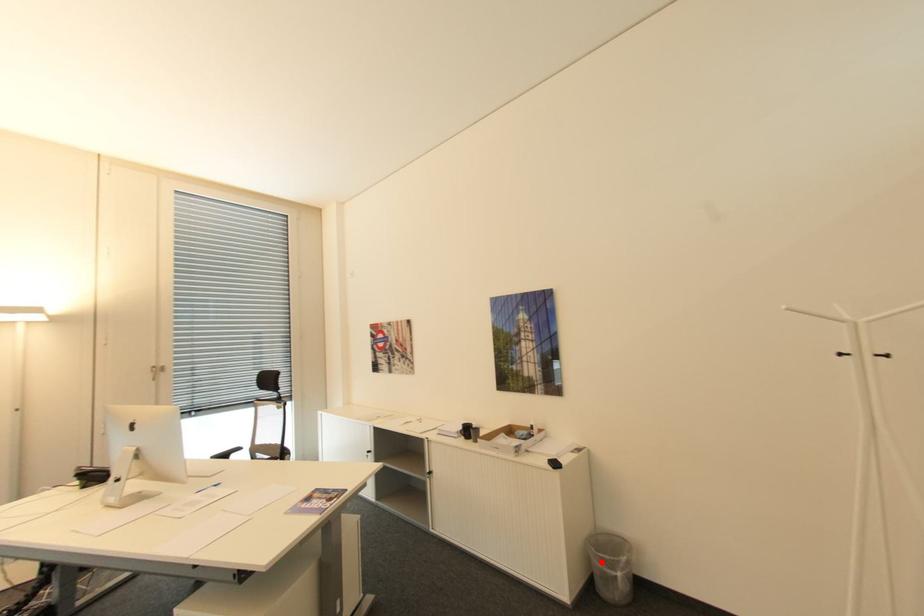
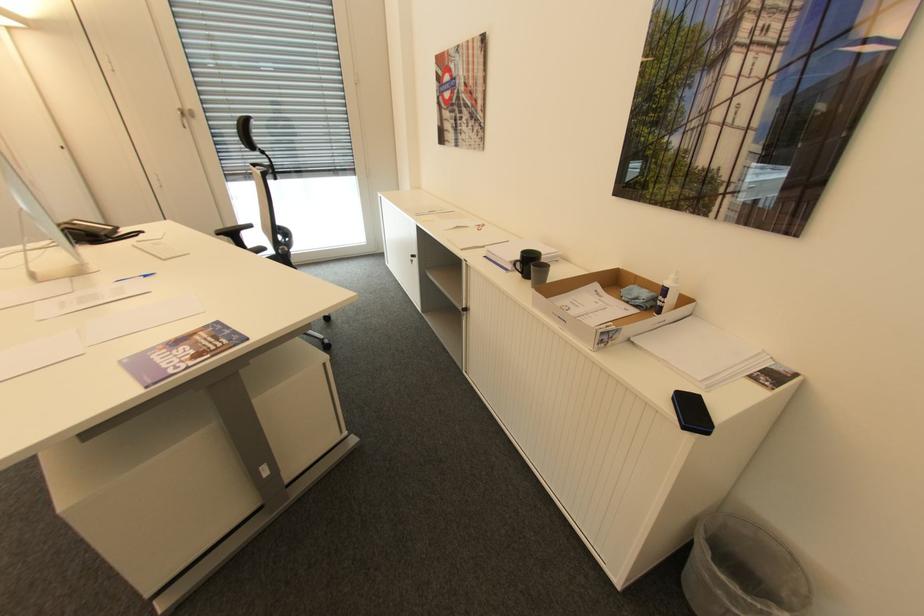
Question: A red point is marked in image1. In image2, is the corresponding 3D point closer to the camera or farther? Reply with the corresponding letter.

Choices:
 (A) The corresponding 3D point is closer.
 (B) The corresponding 3D point is farther.

Answer: (A)